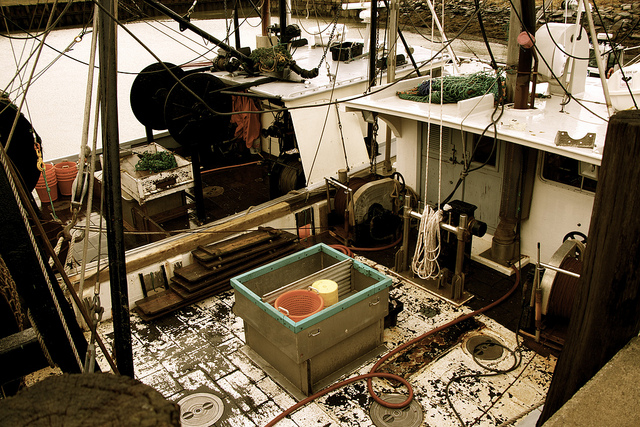
Locate an element on the screen. The width and height of the screenshot is (640, 427). boxes is located at coordinates (333, 332), (336, 360), (148, 182).